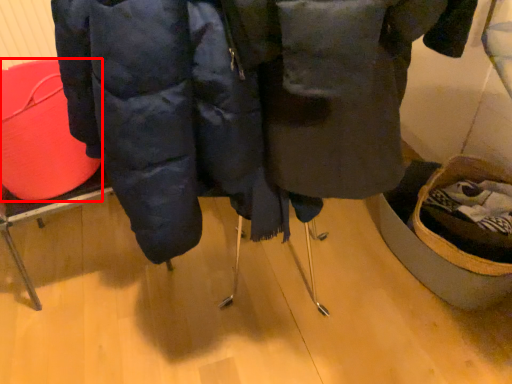
Question: From the image's perspective, what is the correct spatial positioning of basket (annotated by the red box) in reference to jacket?

Choices:
 (A) below
 (B) above

Answer: (B)